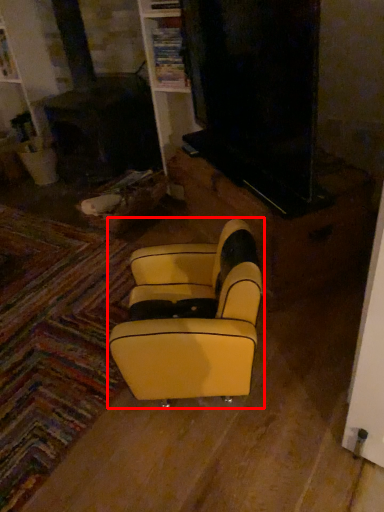
Question: From the image's perspective, what is the correct spatial positioning of rocking chair (annotated by the red box) in reference to furniture?

Choices:
 (A) above
 (B) below

Answer: (B)